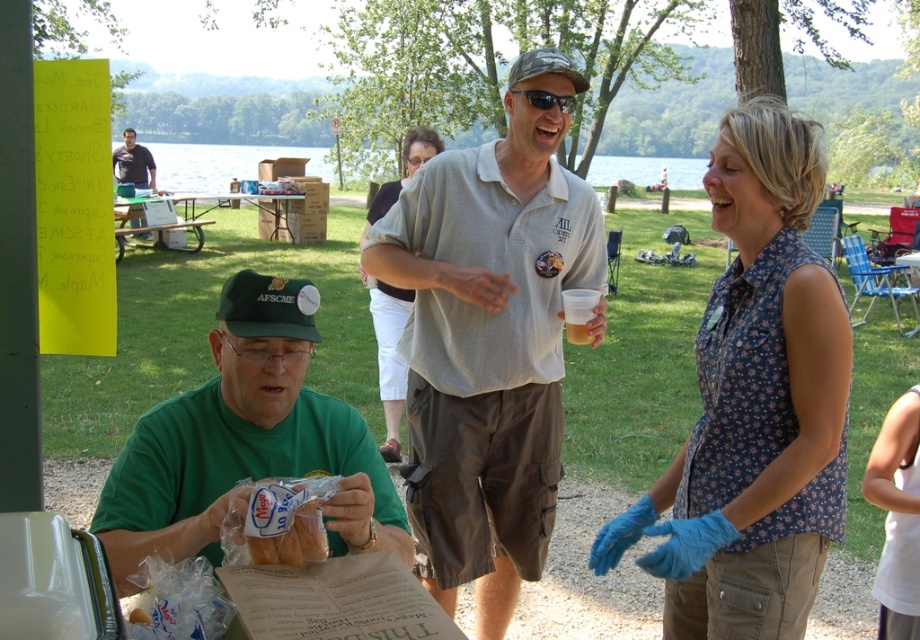
Question: Among these objects, which one is nearest to the camera?

Choices:
 (A) translucent plastic cup at center
 (B) light beige cotton pants at center
 (C) wooden picnic table at center

Answer: (A)

Question: Is green fabric shirt at lower left above translucent plastic cup at center?

Choices:
 (A) no
 (B) yes

Answer: (A)

Question: Which object is positioned farthest from the green fabric shirt at lower left?

Choices:
 (A) translucent plastic cup at center
 (B) light beige cotton pants at center
 (C) light gray polo shirt at center

Answer: (B)

Question: Is wooden picnic table at center smaller than translucent plastic cup at center?

Choices:
 (A) yes
 (B) no

Answer: (B)

Question: Based on their relative distances, which object is farther from the translucent plastic cup at center?

Choices:
 (A) light gray polo shirt at center
 (B) floral print shirt at center
 (C) dark gray shirt at upper left
 (D) white plastic baguette at lower center

Answer: (C)

Question: Is dark gray shirt at upper left to the right of translucent plastic cup at center from the viewer's perspective?

Choices:
 (A) no
 (B) yes

Answer: (A)